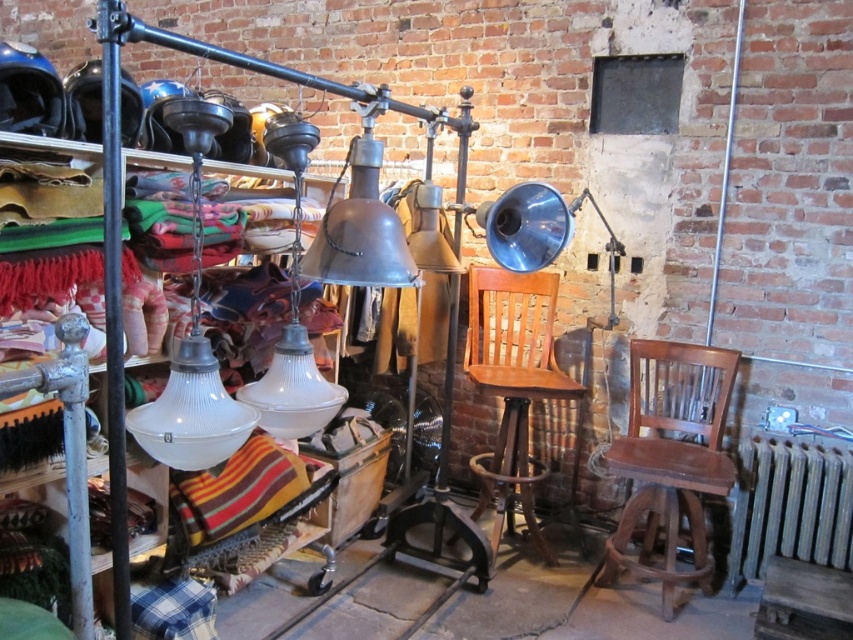
You are standing in the workshop and want to move from the wooden chair at right to the polished metal pole at left. Which object will you encounter first as you move towards the pole?

You will encounter the wooden chair at right first because it is closer to you than the polished metal pole at left, which is further away.

You are a painter who needs to place a 1.8 meter tall easel in this workshop. The wooden chair at center and the polished metal pole at left are in the way. Which object must you move to accommodate the easel?

The wooden chair at center must be moved because it is taller than the polished metal pole at left, making it the obstacle in the way of placing the 1.8 meter tall easel.